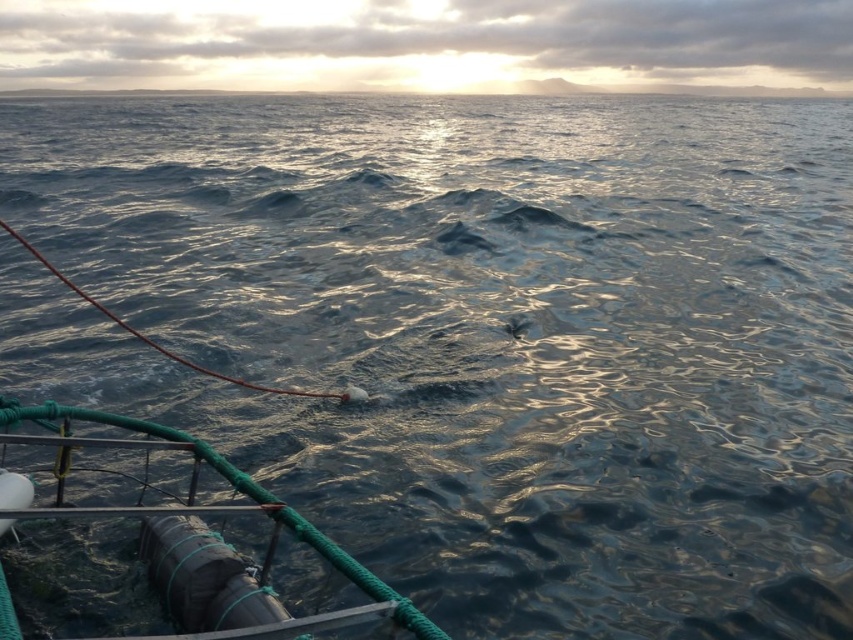
You are an observer standing on the shore looking out at the seascape. You notice the rubberized black cylinder at lower left and the smooth sky at upper center. Which of these two objects takes up more area in the image?

The smooth sky at upper center takes up more area in the image than the rubberized black cylinder at lower left.

You are standing on the deck of a boat and see the rubberized black cylinder at lower left and the smooth sky at upper center. Which object is closer to the horizon?

The smooth sky at upper center is closer to the horizon than the rubberized black cylinder at lower left.